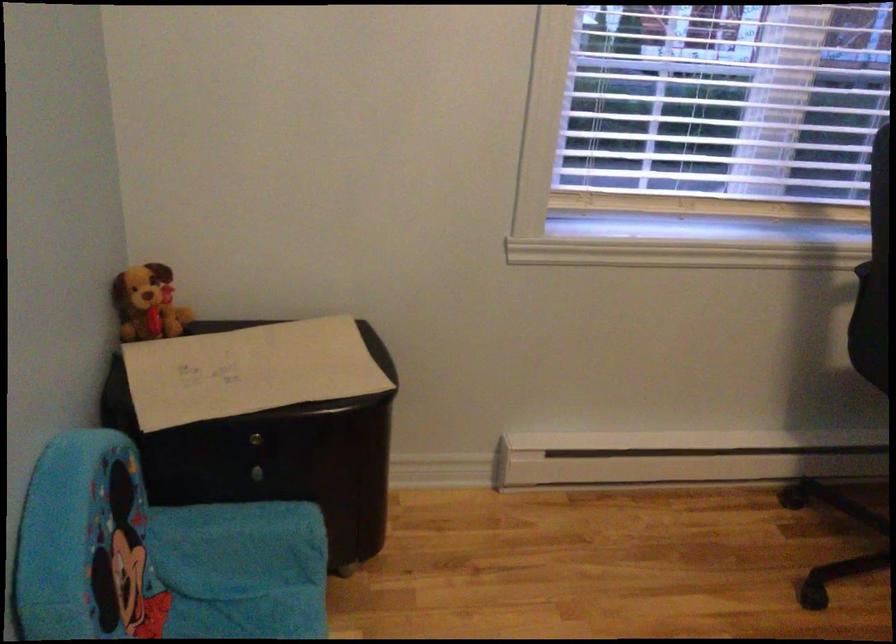
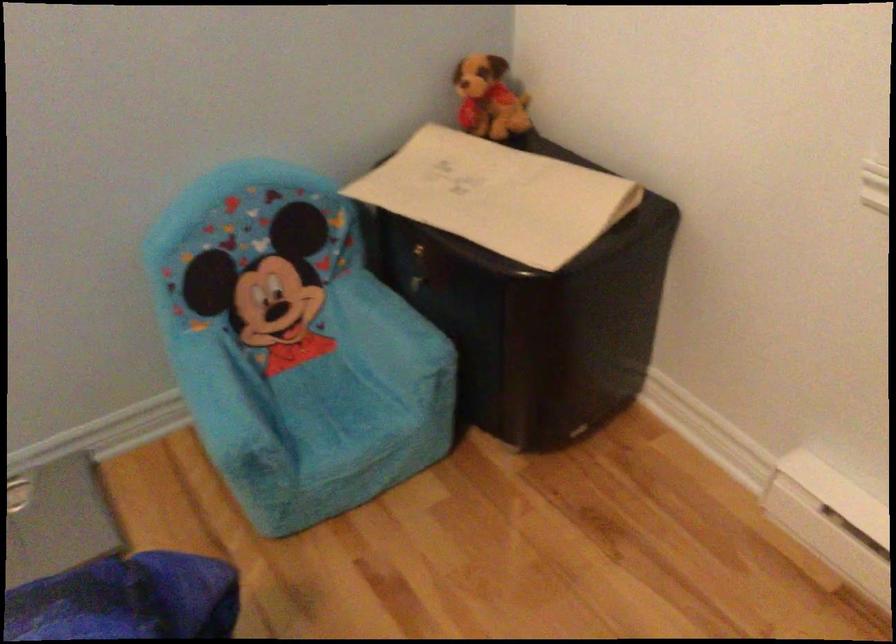
The point at (x=244, y=520) is marked in the first image. Where is the corresponding point in the second image?

(389, 316)